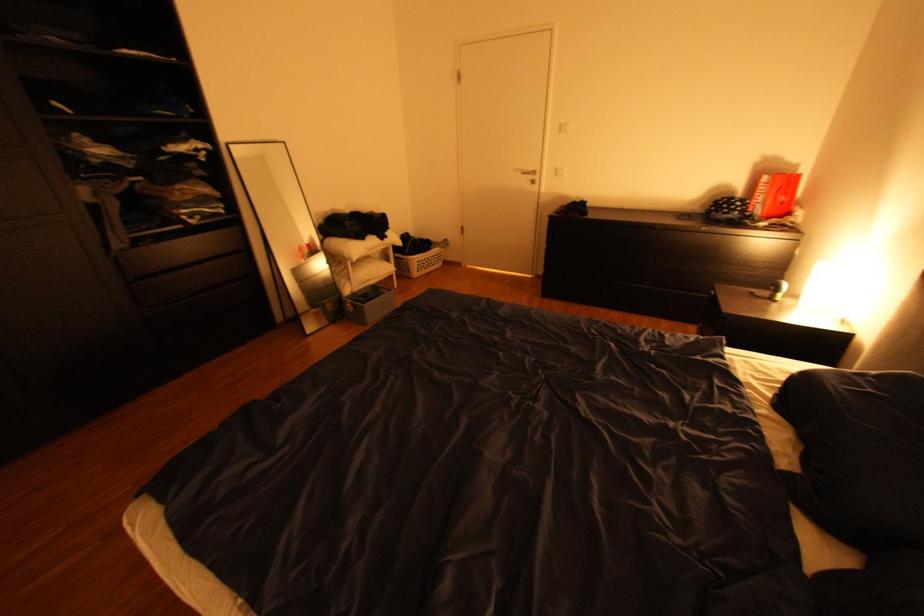
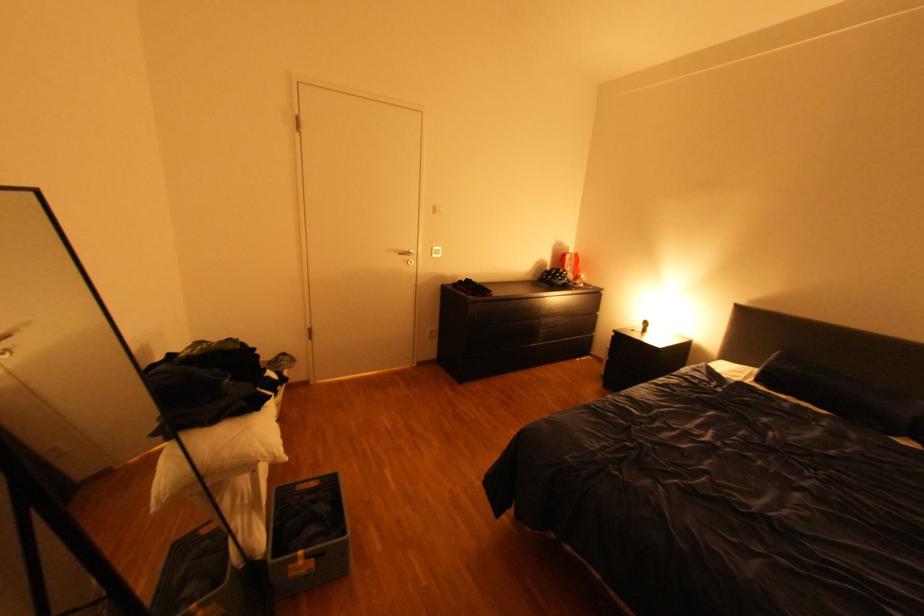
Locate, in the second image, the point that corresponds to point (526, 171) in the first image.

(399, 249)